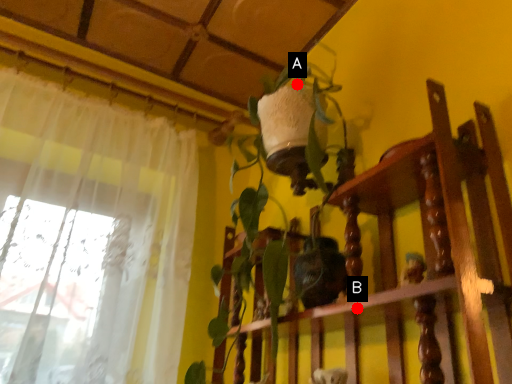
Question: Two points are circled on the image, labeled by A and B beside each circle. Which of the following is the farthest from the observer?

Choices:
 (A) A is further
 (B) B is further

Answer: (A)